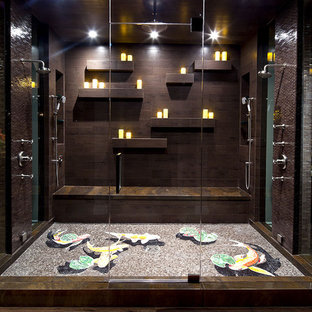
Locate an element on the screen. wall is located at coordinates (148, 70).